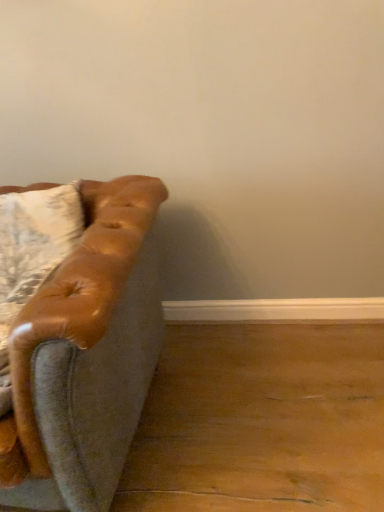
Question: Is leather pillow at left shorter than matte brown leather couch at left?

Choices:
 (A) yes
 (B) no

Answer: (A)

Question: Is leather pillow at left next to matte brown leather couch at left and touching it?

Choices:
 (A) yes
 (B) no

Answer: (B)

Question: Is leather pillow at left to the left of matte brown leather couch at left from the viewer's perspective?

Choices:
 (A) no
 (B) yes

Answer: (A)

Question: Can you confirm if leather pillow at left is smaller than matte brown leather couch at left?

Choices:
 (A) no
 (B) yes

Answer: (B)

Question: From a real-world perspective, is leather pillow at left on matte brown leather couch at left?

Choices:
 (A) yes
 (B) no

Answer: (A)

Question: Is the depth of leather pillow at left greater than that of matte brown leather couch at left?

Choices:
 (A) no
 (B) yes

Answer: (B)

Question: Is matte brown leather couch at left placed right next to leather pillow at left?

Choices:
 (A) yes
 (B) no

Answer: (B)

Question: Does matte brown leather couch at left contain leather pillow at left?

Choices:
 (A) no
 (B) yes

Answer: (B)

Question: Can you confirm if matte brown leather couch at left is positioned to the right of leather pillow at left?

Choices:
 (A) no
 (B) yes

Answer: (A)

Question: From the image's perspective, is matte brown leather couch at left under leather pillow at left?

Choices:
 (A) yes
 (B) no

Answer: (A)

Question: Can you confirm if matte brown leather couch at left is smaller than leather pillow at left?

Choices:
 (A) yes
 (B) no

Answer: (B)

Question: Is the depth of matte brown leather couch at left less than that of leather pillow at left?

Choices:
 (A) yes
 (B) no

Answer: (A)

Question: In the image, is matte brown leather couch at left positioned in front of or behind leather pillow at left?

Choices:
 (A) front
 (B) behind

Answer: (A)